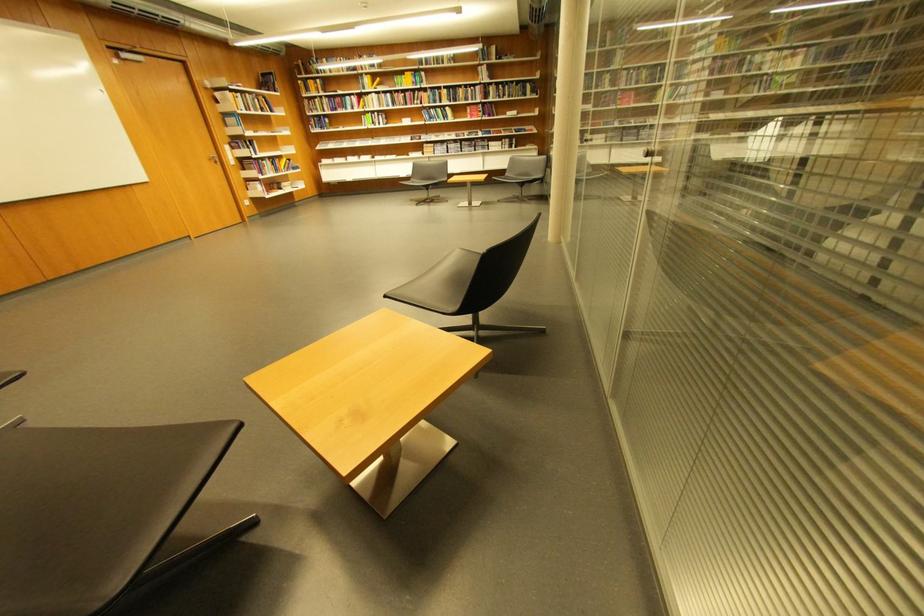
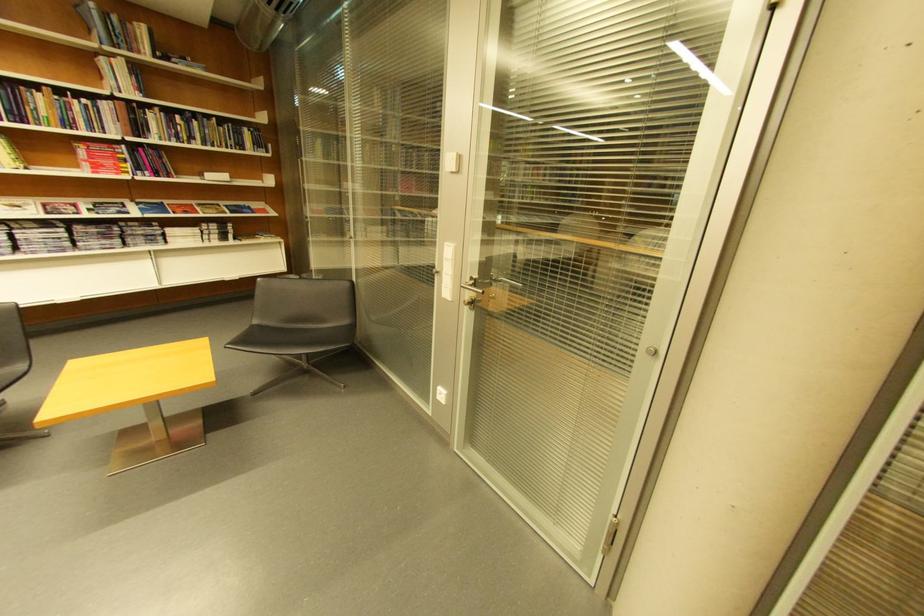
Where in the second image is the point corresponding to (470,99) from the first image?

(54, 116)